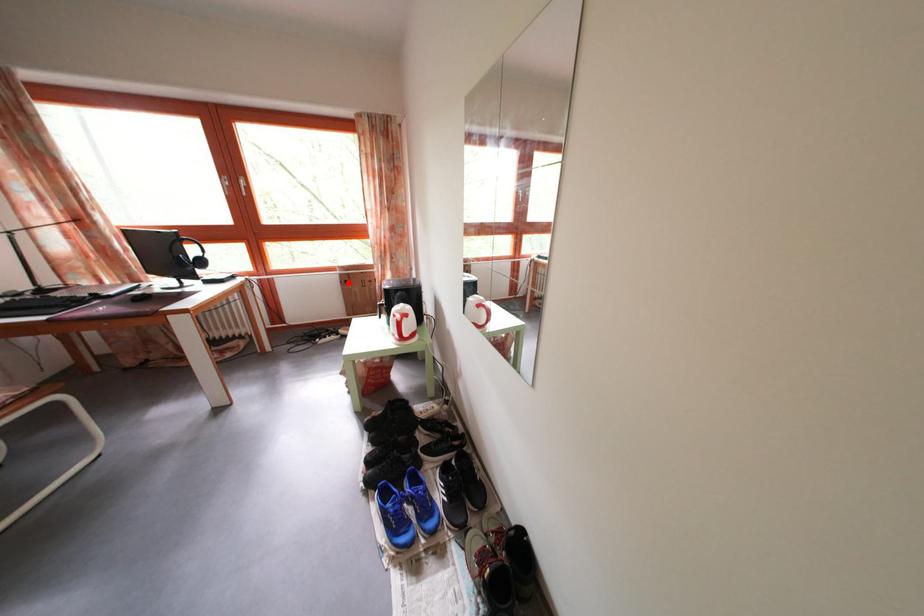
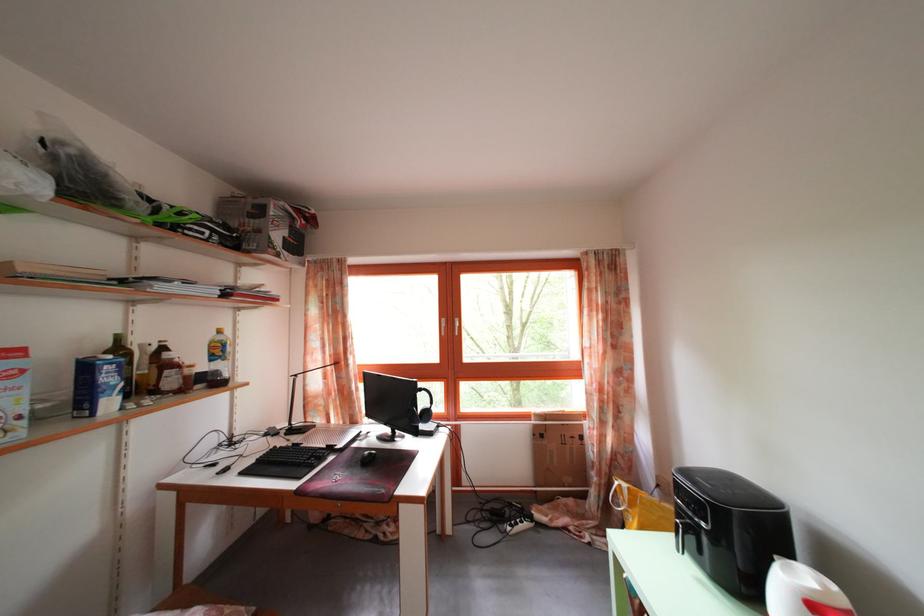
Where in the second image is the point corresponding to the highlighted location from the first image?

(542, 432)